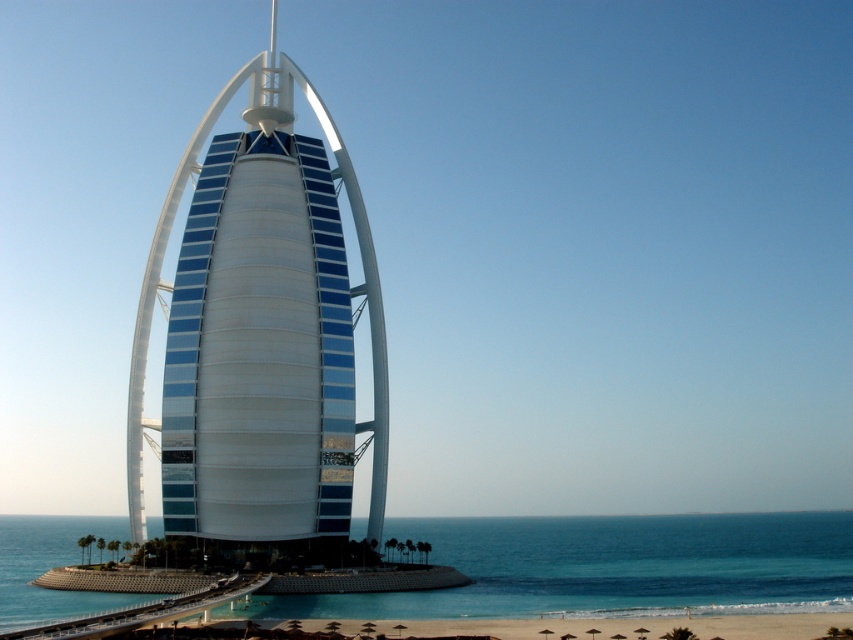
Question: Does white glossy tower at center appear over clear blue water at lower center?

Choices:
 (A) yes
 (B) no

Answer: (A)

Question: Which of the following is the closest to the observer?

Choices:
 (A) white glossy tower at center
 (B) clear blue water at lower center

Answer: (B)

Question: Is white glossy tower at center to the left of clear blue water at lower center from the viewer's perspective?

Choices:
 (A) no
 (B) yes

Answer: (B)

Question: Which object is farther from the camera taking this photo?

Choices:
 (A) white glossy tower at center
 (B) clear blue water at lower center

Answer: (A)

Question: Which point is closer to the camera?

Choices:
 (A) (451, 589)
 (B) (325, 417)

Answer: (B)

Question: Considering the relative positions of white glossy tower at center and clear blue water at lower center in the image provided, where is white glossy tower at center located with respect to clear blue water at lower center?

Choices:
 (A) above
 (B) below

Answer: (A)